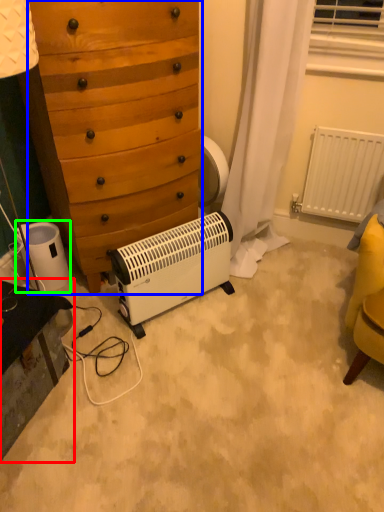
Question: Considering the real-world distances, which object is farthest from vanity (highlighted by a red box)? chest of drawers (highlighted by a blue box) or appliance (highlighted by a green box)?

Choices:
 (A) chest of drawers
 (B) appliance

Answer: (A)